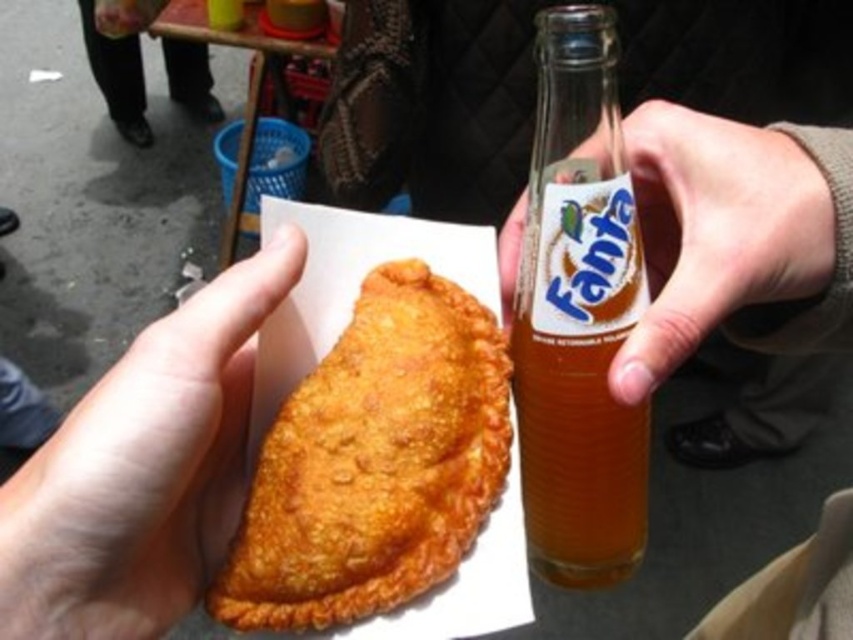
Based on the photo, can you confirm if golden fried pastry at center is positioned below brown leather pants at lower center?

Correct, golden fried pastry at center is located below brown leather pants at lower center.

Who is positioned more to the right, golden fried pastry at center or brown leather pants at lower center?

golden fried pastry at center is more to the right.

What do you see at coordinates (143, 468) in the screenshot? I see `golden fried pastry at center` at bounding box center [143, 468].

Locate an element on the screen. golden fried pastry at center is located at coordinates (143, 468).

Which is in front, point (547, 349) or point (212, 106)?

Point (547, 349)

Measure the distance between point (614, 65) and camera.

Point (614, 65) is 13.33 inches from camera.

In order to click on translucent glass bottle at center in this screenshot , I will do `click(578, 314)`.

Which is in front, point (292, 554) or point (102, 499)?

Point (102, 499) is in front.

Which is below, golden crispy empanada at center or golden fried pastry at center?

golden crispy empanada at center is below.

Find the location of a particular element. golden crispy empanada at center is located at coordinates (375, 461).